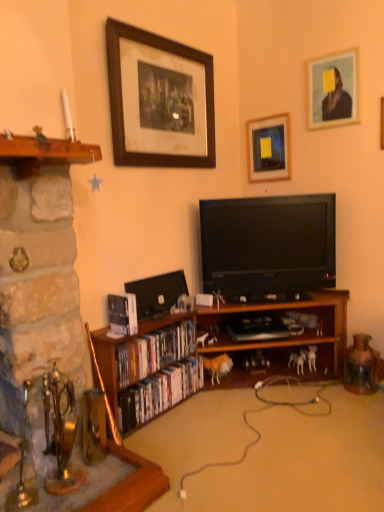
Find the location of a particular element. The height and width of the screenshot is (512, 384). free space in front of matte plastic dvds at lower left, marked as the third book in a top-to-bottom arrangement is located at coordinates (177, 448).